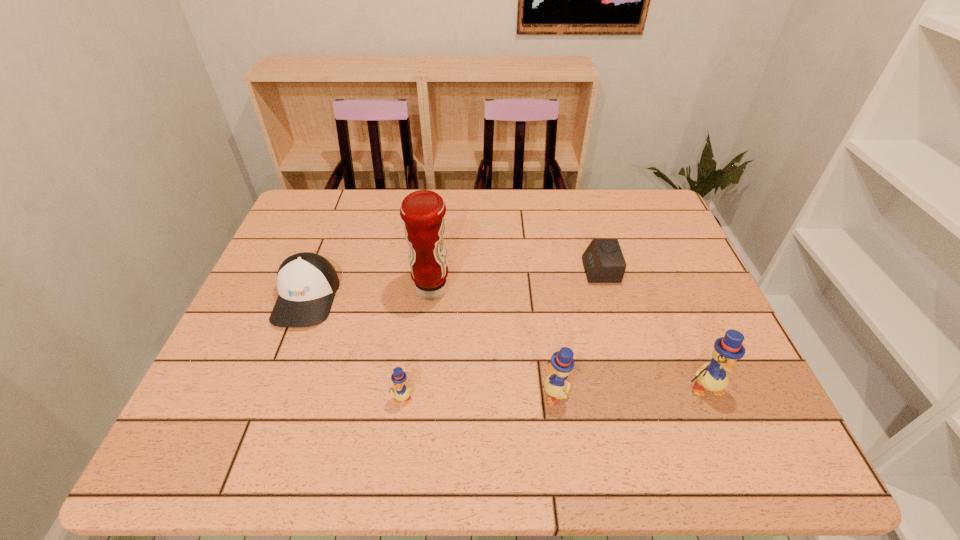
Identify the location of free space at the near edge. click(x=387, y=392).

Image resolution: width=960 pixels, height=540 pixels. I want to click on free space at the left edge of the desktop, so click(228, 342).

The width and height of the screenshot is (960, 540). Find the location of `free space at the right edge of the desktop`. free space at the right edge of the desktop is located at coordinates [687, 284].

Where is `vacant area at the far left corner of the desktop`? The width and height of the screenshot is (960, 540). vacant area at the far left corner of the desktop is located at coordinates (315, 227).

The image size is (960, 540). In the image, there is a desktop. Find the location of `vacant space at the far right corner`. vacant space at the far right corner is located at coordinates (626, 192).

This screenshot has width=960, height=540. Find the location of `free spot between the fourth object from left to right and the condiment`. free spot between the fourth object from left to right and the condiment is located at coordinates coord(493,341).

Identify the location of unoccupied area between the leftmost object and the third object from right to left. Image resolution: width=960 pixels, height=540 pixels. (431, 345).

This screenshot has width=960, height=540. What are the coordinates of `vacant area that lies between the cap and the second duckling from left to right` in the screenshot? It's located at (431, 345).

This screenshot has height=540, width=960. I want to click on blank region between the second duckling from right to left and the shortest duckling, so click(x=479, y=396).

Locate an element on the screen. The height and width of the screenshot is (540, 960). vacant space that is in between the cap and the tallest object is located at coordinates (369, 294).